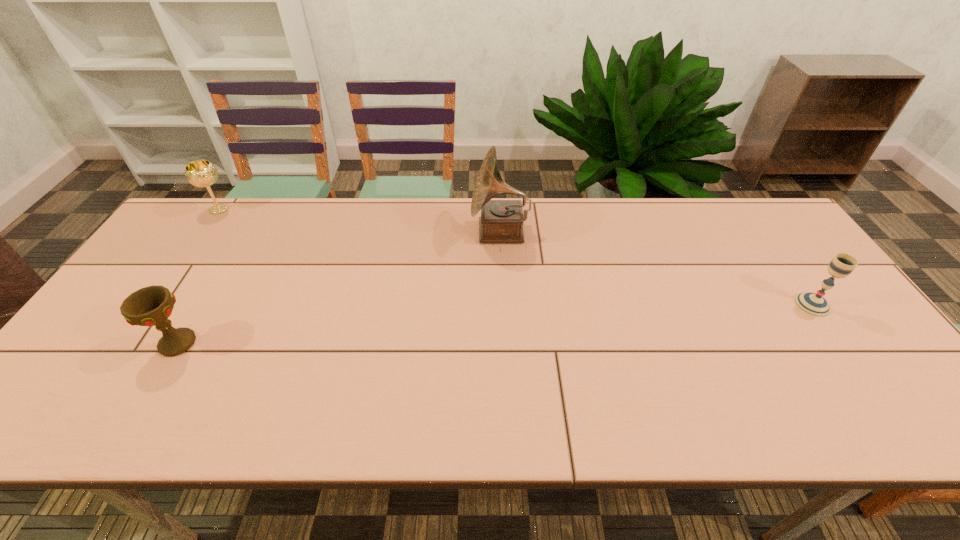
Locate an element on the screen. The height and width of the screenshot is (540, 960). free spot at the near edge of the desktop is located at coordinates (222, 417).

In the image, there is a desktop. At what (x,y) coordinates should I click in order to perform the action: click on vacant region at the left edge. Please return your answer as a coordinate pair (x, y). The width and height of the screenshot is (960, 540). Looking at the image, I should click on (141, 345).

Image resolution: width=960 pixels, height=540 pixels. What are the coordinates of `vacant region at the far left corner of the desktop` in the screenshot? It's located at (205, 222).

In the image, there is a desktop. At what (x,y) coordinates should I click in order to perform the action: click on vacant space at the far right corner. Please return your answer as a coordinate pair (x, y). This screenshot has width=960, height=540. Looking at the image, I should click on (747, 204).

At what (x,y) coordinates should I click in order to perform the action: click on vacant area that lies between the nearest chalice and the rightmost chalice. Please return your answer as a coordinate pair (x, y). The image size is (960, 540). Looking at the image, I should click on (494, 324).

You are a GUI agent. You are given a task and a screenshot of the screen. Output one action in this format:
    pyautogui.click(x=<x>, y=<y>)
    Task: Click on the empty location between the leftmost chalice and the tallest object
    This screenshot has width=960, height=540.
    Given the screenshot: What is the action you would take?
    pyautogui.click(x=360, y=220)

In order to click on unoccupied area between the third farthest object and the third object from right to left in this screenshot , I will do `click(494, 324)`.

Find the location of a particular element. The width and height of the screenshot is (960, 540). free area in between the nearest object and the rightmost object is located at coordinates [x=494, y=324].

This screenshot has height=540, width=960. I want to click on vacant area between the leftmost chalice and the second farthest chalice, so click(x=516, y=257).

Identify the location of empty location between the rightmost object and the leftmost object. This screenshot has width=960, height=540. (516, 257).